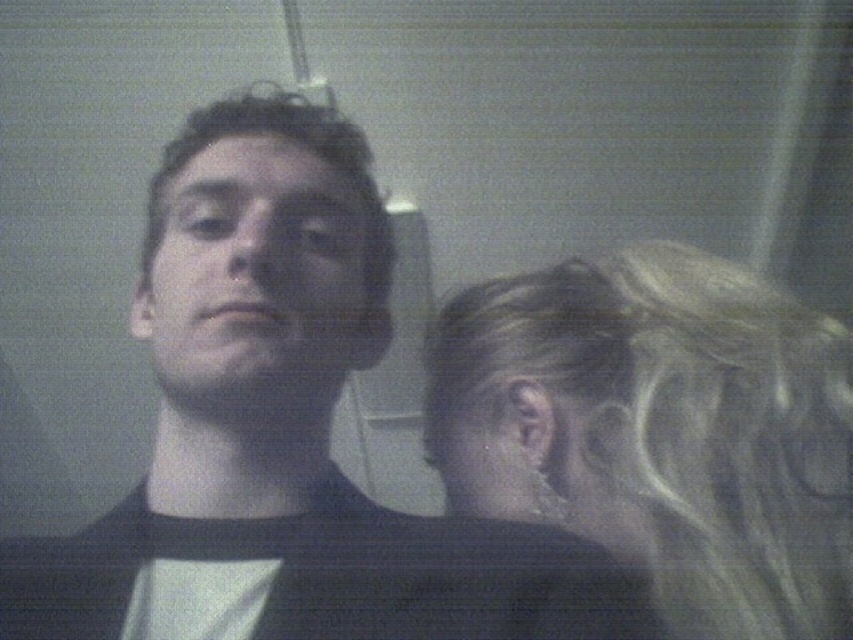
You are a photographer trying to adjust the lighting in the scene. You notice the black matte shirt at center and the matte black face at center. Which object is positioned to the left of the other?

The black matte shirt at center is to the left of the matte black face at center.

In the image, you see a person with blonde hair at right and a matte black face at center. Which one is positioned further to the right side of the frame?

The blonde hair at right is positioned further to the right side of the frame than the matte black face at center.

Based on the scene description, can you determine the spatial relationship between the matte black face at center and the blonde hair at right?

The matte black face at center is behind the blonde hair at right.